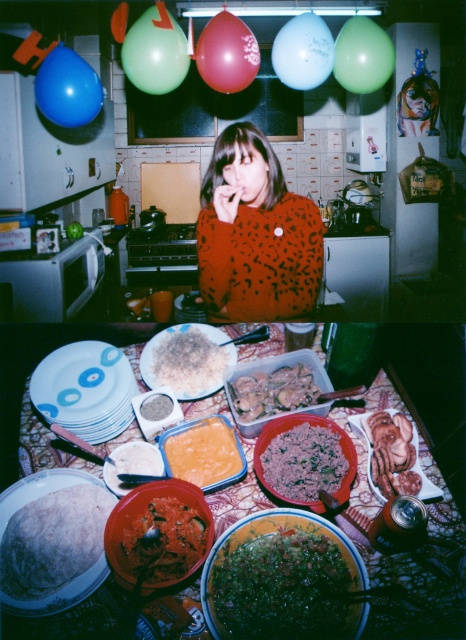
Does point (200, 365) come closer to viewer compared to point (239, 404)?

No, it is not.

Can you confirm if white rice at center is positioned to the left of slightly pinkish glossy meat at center?

Yes, white rice at center is to the left of slightly pinkish glossy meat at center.

Locate an element on the screen. The width and height of the screenshot is (466, 640). white rice at center is located at coordinates 190,362.

Does white dough at center appear on the right side of smooth brown meat at center?

No, white dough at center is not to the right of smooth brown meat at center.

Based on the photo, between white dough at center and smooth brown meat at center, which one appears on the right side from the viewer's perspective?

Positioned to the right is smooth brown meat at center.

Is point (14, 547) closer to camera compared to point (402, 442)?

Yes, point (14, 547) is in front of point (402, 442).

Identify the location of white dough at center. point(54,540).

Does white dough at center come behind white rice at center?

No, it is not.

This screenshot has width=466, height=640. I want to click on white dough at center, so click(54, 540).

What do you see at coordinates (54, 540) in the screenshot?
I see `white dough at center` at bounding box center [54, 540].

Locate an element on the screen. This screenshot has height=640, width=466. white dough at center is located at coordinates (54, 540).